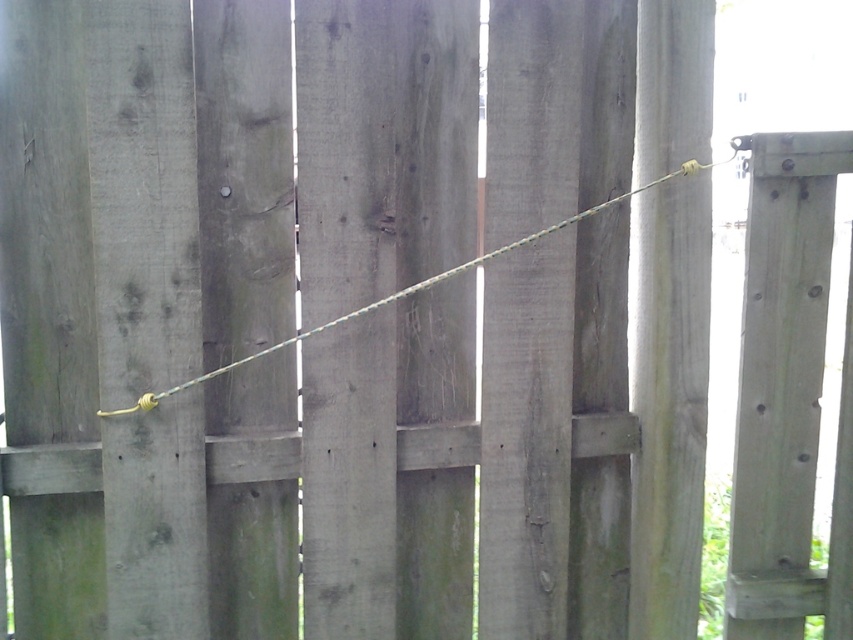
Which is more to the left, gray wood pole at right or green rope at center?

green rope at center

Is gray wood pole at right positioned in front of green rope at center?

No, it is behind green rope at center.

Identify the location of gray wood pole at right. (669, 404).